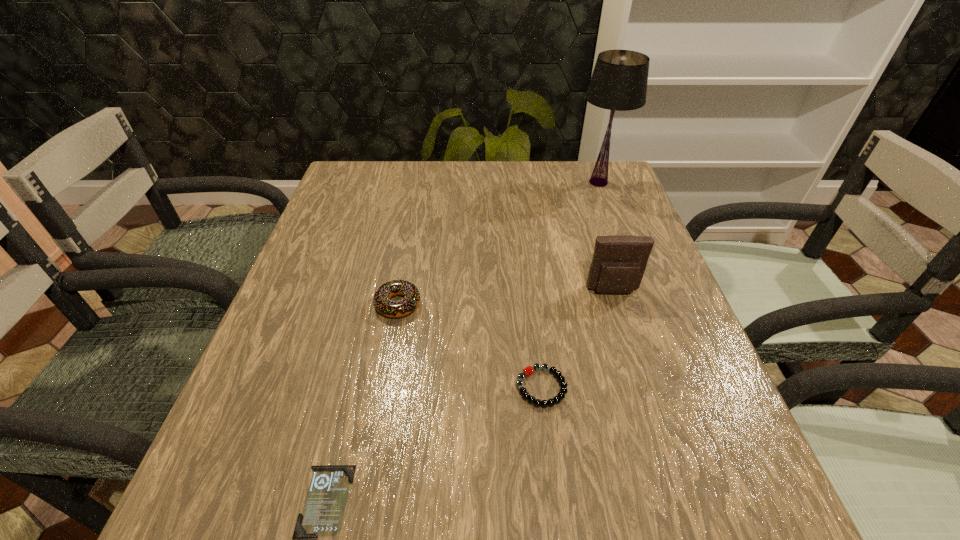
The image size is (960, 540). What are the coordinates of `object that is at the near left corner` in the screenshot? It's located at (322, 515).

You are a GUI agent. You are given a task and a screenshot of the screen. Output one action in this format:
    pyautogui.click(x=<x>, y=<y>)
    Task: Click on the object positioned at the far right corner
    
    Given the screenshot: What is the action you would take?
    pyautogui.click(x=619, y=81)

Identify the location of vacant space at the far edge of the desktop. This screenshot has height=540, width=960. (391, 198).

This screenshot has height=540, width=960. I want to click on free space at the left edge, so click(325, 255).

In the image, there is a desktop. What are the coordinates of `vacant space at the right edge` in the screenshot? It's located at (641, 386).

I want to click on free region at the far left corner of the desktop, so click(x=333, y=187).

This screenshot has height=540, width=960. In the image, there is a desktop. In order to click on vacant space at the near left corner in this screenshot , I will do `click(208, 515)`.

You are a GUI agent. You are given a task and a screenshot of the screen. Output one action in this format:
    pyautogui.click(x=<x>, y=<y>)
    Task: Click on the vacant point at the far right corner
    This screenshot has height=540, width=960.
    Given the screenshot: What is the action you would take?
    pyautogui.click(x=590, y=172)

Where is `free space that is in between the identity card and the second shortest object`? Image resolution: width=960 pixels, height=540 pixels. free space that is in between the identity card and the second shortest object is located at coordinates (434, 444).

Locate an element on the screen. This screenshot has width=960, height=540. vacant area that lies between the lampshade and the doughnut is located at coordinates (498, 243).